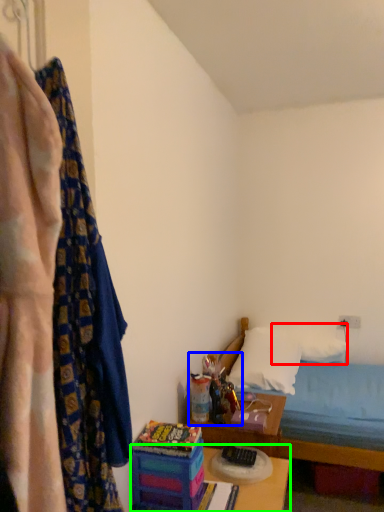
Question: Considering the real-world distances, which object is farthest from pillow (highlighted by a red box)? toy (highlighted by a blue box) or table (highlighted by a green box)?

Choices:
 (A) toy
 (B) table

Answer: (B)